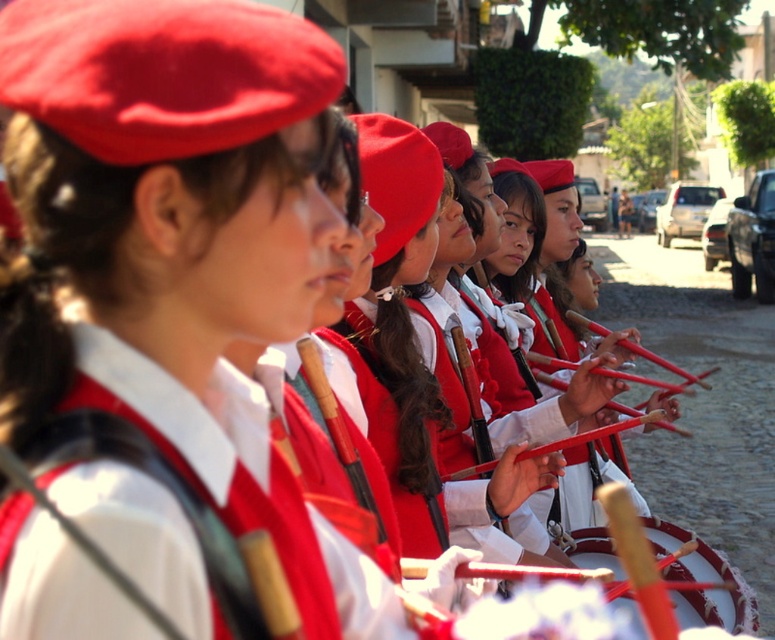
You are a photographer positioned at the origin point of the image. You want to capture a closeup shot of the matte red beret at center. According to the coordinates provided, in which direction should you move your camera to focus on the beret?

The matte red beret at center is located at point coordinates. Since you are at the origin, you need to move your camera to the right and upwards to reach the beret.